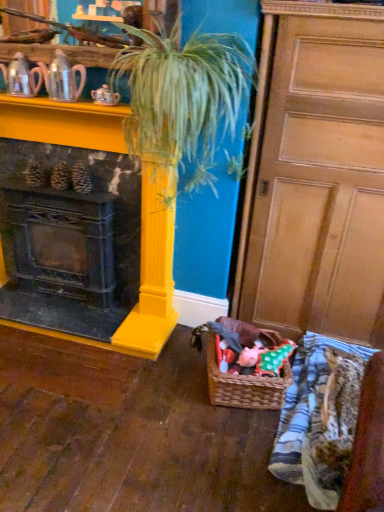
The width and height of the screenshot is (384, 512). What do you see at coordinates (317, 176) in the screenshot?
I see `wooden at center` at bounding box center [317, 176].

What do you see at coordinates (21, 77) in the screenshot? The height and width of the screenshot is (512, 384). I see `metallic silver teapot at left, placed as the second tea pot when sorted from right to left` at bounding box center [21, 77].

Describe the element at coordinates (63, 78) in the screenshot. I see `matte silver teapot at upper left, which is counted as the first tea pot, starting from the right` at that location.

Describe the element at coordinates (251, 355) in the screenshot. I see `velvety plush toy at lower center` at that location.

You are a GUI agent. You are given a task and a screenshot of the screen. Output one action in this format:
    pyautogui.click(x=<x>, y=<y>)
    Task: Click on the black cast iron fireplace at left
    This screenshot has width=384, height=512.
    Given the screenshot: What is the action you would take?
    pyautogui.click(x=152, y=270)

Considering the relative sizes of metallic silver teapot at left, the 1th tea pot viewed from the left, and striped cotton blanket at lower right in the image provided, is metallic silver teapot at left, the 1th tea pot viewed from the left, smaller than striped cotton blanket at lower right?

Indeed, metallic silver teapot at left, the 1th tea pot viewed from the left, has a smaller size compared to striped cotton blanket at lower right.

Locate an element on the screen. The image size is (384, 512). tea pot that is the 2nd one when counting backward from the striped cotton blanket at lower right is located at coordinates (21, 77).

Is metallic silver teapot at left, placed as the second tea pot when sorted from right to left, wider or thinner than striped cotton blanket at lower right?

Clearly, metallic silver teapot at left, placed as the second tea pot when sorted from right to left, has less width compared to striped cotton blanket at lower right.

From a real-world perspective, relative to striped cotton blanket at lower right, is metallic silver teapot at left, placed as the second tea pot when sorted from right to left, vertically above or below?

From a real-world perspective, metallic silver teapot at left, placed as the second tea pot when sorted from right to left, is physically above striped cotton blanket at lower right.

Consider the image. Is striped cotton blanket at lower right located outside velvety plush toy at lower center?

Yes, striped cotton blanket at lower right is located beyond the bounds of velvety plush toy at lower center.

Considering the sizes of objects striped cotton blanket at lower right and velvety plush toy at lower center in the image provided, who is smaller, striped cotton blanket at lower right or velvety plush toy at lower center?

velvety plush toy at lower center.

Locate an element on the screen. The width and height of the screenshot is (384, 512). clothing below the velvety plush toy at lower center (from the image's perspective) is located at coordinates (319, 419).

Considering the positions of objects woven brown basket at lower center and metallic silver teapot at left, the 1th tea pot viewed from the left, in the image provided, who is more to the right, woven brown basket at lower center or metallic silver teapot at left, the 1th tea pot viewed from the left,?

woven brown basket at lower center is more to the right.

Is woven brown basket at lower center behind metallic silver teapot at left, the 1th tea pot viewed from the left?

No, woven brown basket at lower center is in front of metallic silver teapot at left, the 1th tea pot viewed from the left.

Based on their sizes in the image, would you say woven brown basket at lower center is bigger or smaller than metallic silver teapot at left, placed as the second tea pot when sorted from right to left?

In the image, woven brown basket at lower center appears to be larger than metallic silver teapot at left, placed as the second tea pot when sorted from right to left.

Is woven brown basket at lower center next to metallic silver teapot at left, the 1th tea pot viewed from the left, and touching it?

No, woven brown basket at lower center is not with metallic silver teapot at left, the 1th tea pot viewed from the left.

Looking at this image, considering the sizes of green leafy plant at center and striped cotton blanket at lower right in the image, is green leafy plant at center bigger or smaller than striped cotton blanket at lower right?

Clearly, green leafy plant at center is larger in size than striped cotton blanket at lower right.

Is point (236, 50) more distant than point (302, 472)?

Yes, it is behind point (302, 472).

Which object is further away from the camera taking this photo, green leafy plant at center or striped cotton blanket at lower right?

Positioned behind is striped cotton blanket at lower right.

Is green leafy plant at center oriented towards striped cotton blanket at lower right?

No, green leafy plant at center is not turned towards striped cotton blanket at lower right.

From a real-world perspective, is black cast iron fireplace at left on metallic silver teapot at left, the 1th tea pot viewed from the left?

No, from a real-world perspective, black cast iron fireplace at left is not on top of metallic silver teapot at left, the 1th tea pot viewed from the left.

Find the location of a particular element. This screenshot has width=384, height=512. fireplace below the metallic silver teapot at left, placed as the second tea pot when sorted from right to left (from a real-world perspective) is located at coordinates (152, 270).

Can you confirm if black cast iron fireplace at left is shorter than metallic silver teapot at left, placed as the second tea pot when sorted from right to left?

Incorrect, the height of black cast iron fireplace at left does not fall short of that of metallic silver teapot at left, placed as the second tea pot when sorted from right to left.

Considering the positions of points (150, 257) and (8, 77), is point (150, 257) farther from camera compared to point (8, 77)?

Yes.

Which object is wider, woven brown basket at lower center or green leafy plant at center?

green leafy plant at center is wider.

Between point (268, 330) and point (214, 68), which one is positioned behind?

Point (268, 330)

Can you confirm if woven brown basket at lower center is shorter than green leafy plant at center?

Yes, woven brown basket at lower center is shorter than green leafy plant at center.

Considering the positions of point (148, 100) and point (245, 356), is point (148, 100) closer or farther from the camera than point (245, 356)?

Point (148, 100) is positioned closer to the camera compared to point (245, 356).

Can you confirm if green leafy plant at center is bigger than velvety plush toy at lower center?

Correct, green leafy plant at center is larger in size than velvety plush toy at lower center.

Based on the photo, from their relative heights in the image, would you say green leafy plant at center is taller or shorter than velvety plush toy at lower center?

Clearly, green leafy plant at center is taller compared to velvety plush toy at lower center.

Which of these two, green leafy plant at center or velvety plush toy at lower center, is thinner?

With smaller width is velvety plush toy at lower center.

This screenshot has width=384, height=512. Identify the location of the 2nd tea pot behind the striped cotton blanket at lower right, starting your count from the anchor. (21, 77).

Where is `toy on the left of striped cotton blanket at lower right`? Image resolution: width=384 pixels, height=512 pixels. toy on the left of striped cotton blanket at lower right is located at coordinates (251, 355).

When comparing their distances from woven brown basket at lower center, does wooden at center or matte silver teapot at upper left, which is counted as the first tea pot, starting from the right, seem further?

matte silver teapot at upper left, which is counted as the first tea pot, starting from the right, lies further to woven brown basket at lower center than the other object.

Looking at this image, estimate the real-world distances between objects in this image. Which object is further from black cast iron fireplace at left, matte silver teapot at upper left, which is counted as the first tea pot, starting from the right, or velvety plush toy at lower center?

The object further to black cast iron fireplace at left is velvety plush toy at lower center.

When comparing their distances from velvety plush toy at lower center, does striped cotton blanket at lower right or black cast iron fireplace at left seem closer?

striped cotton blanket at lower right.

When comparing their distances from woven brown basket at lower center, does velvety plush toy at lower center or green leafy plant at center seem further?

Among the two, green leafy plant at center is located further to woven brown basket at lower center.

Looking at the image, which one is located further to woven brown basket at lower center, velvety plush toy at lower center or wooden at center?

wooden at center lies further to woven brown basket at lower center than the other object.

Looking at the image, which one is located further to black cast iron fireplace at left, striped cotton blanket at lower right or matte silver teapot at upper left, marked as the 2th tea pot in a left-to-right arrangement?

Among the two, striped cotton blanket at lower right is located further to black cast iron fireplace at left.

Estimate the real-world distances between objects in this image. Which object is further from matte silver teapot at upper left, marked as the 2th tea pot in a left-to-right arrangement, black cast iron fireplace at left or metallic silver teapot at left, placed as the second tea pot when sorted from right to left?

black cast iron fireplace at left lies further to matte silver teapot at upper left, marked as the 2th tea pot in a left-to-right arrangement, than the other object.

Which object lies further to the anchor point black cast iron fireplace at left, striped cotton blanket at lower right or green leafy plant at center?

Based on the image, striped cotton blanket at lower right appears to be further to black cast iron fireplace at left.

This screenshot has width=384, height=512. Identify the location of door between green leafy plant at center and woven brown basket at lower center vertically. (x=317, y=176).

This screenshot has width=384, height=512. I want to click on houseplant between matte silver teapot at upper left, which is counted as the first tea pot, starting from the right, and wooden at center, in the horizontal direction, so click(182, 98).

Identify the location of basket between wooden at center and striped cotton blanket at lower right in the vertical direction. (245, 386).

Find the location of a particular element. Image resolution: width=384 pixels, height=512 pixels. fireplace located between metallic silver teapot at left, placed as the second tea pot when sorted from right to left, and wooden at center in the left-right direction is located at coordinates (152, 270).